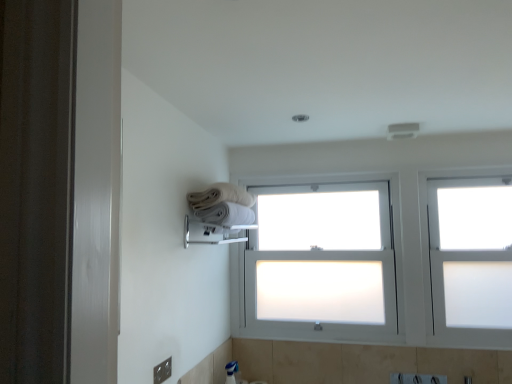
Question: Visually, is white frosted glass bay window at center positioned to the left or to the right of metallic silver outlet at lower left?

Choices:
 (A) left
 (B) right

Answer: (B)

Question: From the image's perspective, relative to metallic silver outlet at lower left, is white frosted glass bay window at center above or below?

Choices:
 (A) below
 (B) above

Answer: (B)

Question: Considering the real-world distances, which object is closest to the polished chrome towel bar at upper center?

Choices:
 (A) metallic silver outlet at lower left
 (B) white frosted glass bay window at center
 (C) white cotton towels at upper center, which is counted as the 1th towel, starting from the top
 (D) white frosted glass window at upper right
 (E) white soft towel at upper center, positioned as the first towel in bottom-to-top order

Answer: (E)

Question: Which of these objects is positioned closest to the polished chrome towel bar at upper center?

Choices:
 (A) white soft towel at upper center, positioned as the first towel in bottom-to-top order
 (B) metallic silver outlet at lower left
 (C) white frosted glass window at upper right
 (D) white cotton towels at upper center, which is counted as the 1th towel, starting from the top
 (E) white frosted glass bay window at center

Answer: (A)